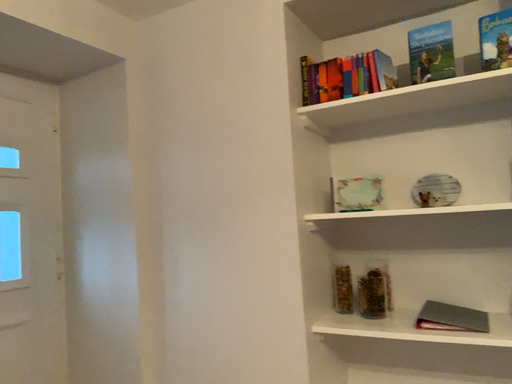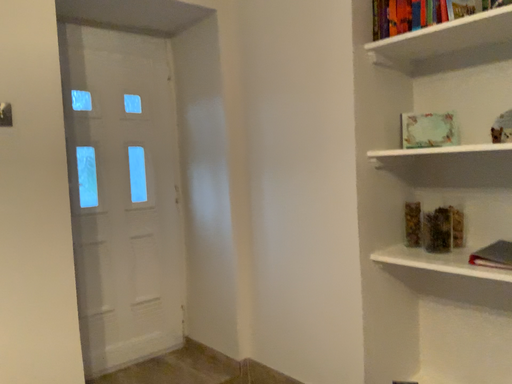
Question: Which way did the camera rotate in the video?

Choices:
 (A) rotated downward
 (B) rotated upward

Answer: (A)